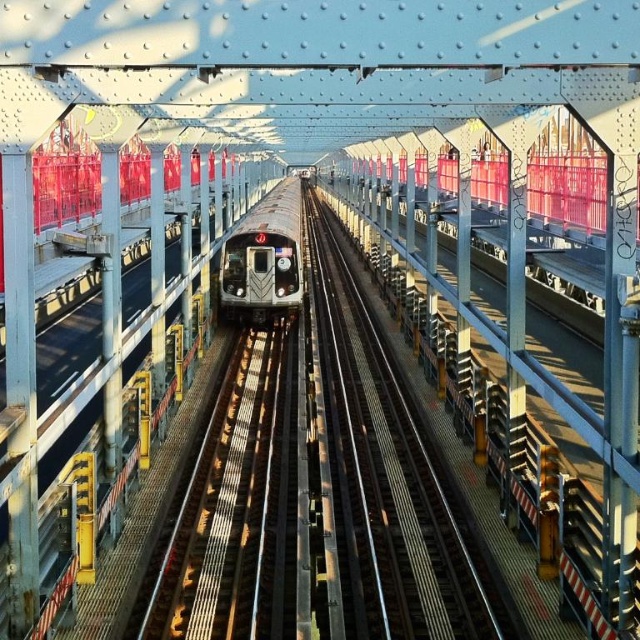
Question: Which of the following is the closest to the observer?

Choices:
 (A) (272, 269)
 (B) (392, 486)

Answer: (B)

Question: Among these points, which one is nearest to the camera?

Choices:
 (A) (266, 208)
 (B) (403, 516)

Answer: (B)

Question: Is metal train track at center smaller than silver metallic train at center?

Choices:
 (A) yes
 (B) no

Answer: (A)

Question: In this image, where is metal train track at center located relative to silver metallic train at center?

Choices:
 (A) right
 (B) left

Answer: (A)

Question: Does metal train track at center appear under silver metallic train at center?

Choices:
 (A) yes
 (B) no

Answer: (A)